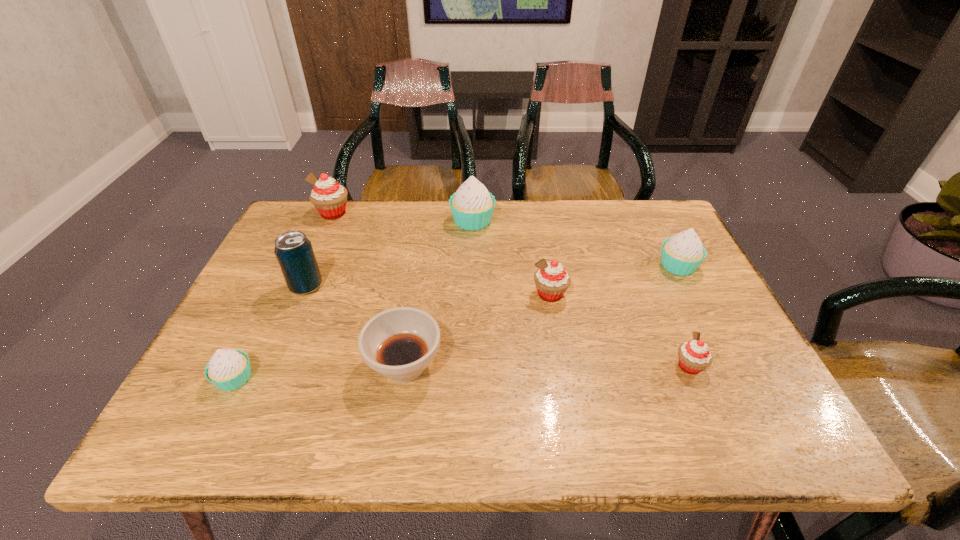
Locate an element on the screen. vacant space situated 0.390m on the left of the nearest pink cupcake is located at coordinates (490, 366).

Locate an element on the screen. The height and width of the screenshot is (540, 960). free point located on the back of the nearest white cupcake is located at coordinates (300, 247).

In order to click on soda can located at the left edge in this screenshot , I will do `click(294, 252)`.

Where is `object located in the far left corner section of the desktop`? Image resolution: width=960 pixels, height=540 pixels. object located in the far left corner section of the desktop is located at coordinates coord(329,197).

The image size is (960, 540). Find the location of `blank space at the far edge`. blank space at the far edge is located at coordinates (361, 232).

The image size is (960, 540). What are the coordinates of `free spot at the near edge of the desktop` in the screenshot? It's located at (664, 442).

Locate an element on the screen. free region at the left edge is located at coordinates (263, 351).

In the image, there is a desktop. At what (x,y) coordinates should I click in order to perform the action: click on free region at the right edge. Please return your answer as a coordinate pair (x, y). This screenshot has height=540, width=960. Looking at the image, I should click on (711, 323).

Find the location of a particular element. Image resolution: width=960 pixels, height=540 pixels. vacant space at the far left corner is located at coordinates (332, 226).

Locate an element on the screen. This screenshot has width=960, height=540. free space at the near left corner of the desktop is located at coordinates (180, 424).